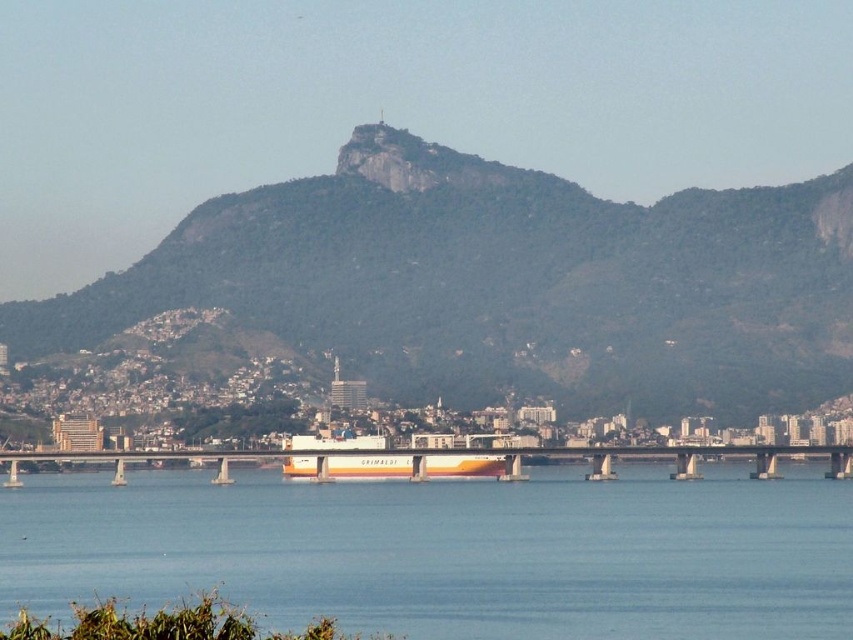
You are standing at the point with coordinates point (506, 323) and want to walk towards the point with coordinates point (828, 468). Which direction should you move relative to the mountain in the background?

You should move away from the mountain in the background because point (506, 323) is in front of point (828, 468), meaning the latter is farther back towards the mountain.